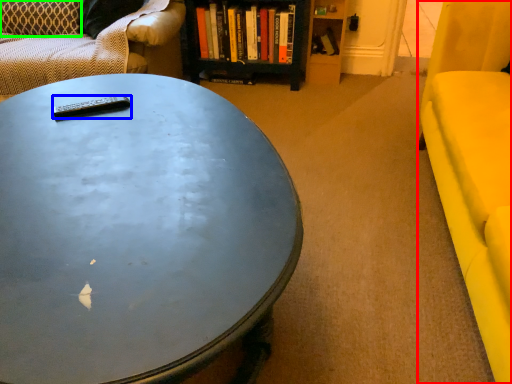
Question: Which is nearer to the armchair (highlighted by a red box)? remote control (highlighted by a blue box) or pillow (highlighted by a green box).

Choices:
 (A) remote control
 (B) pillow

Answer: (A)